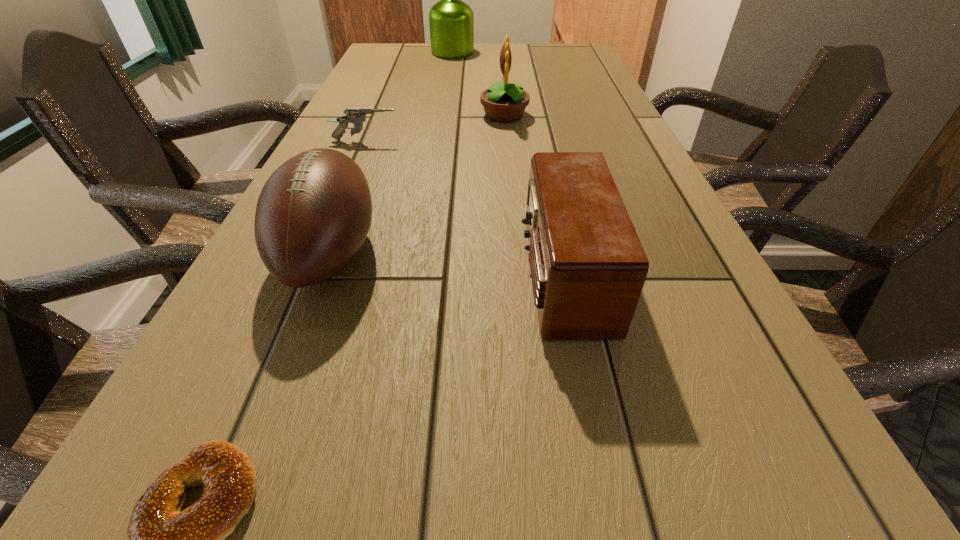
The image size is (960, 540). Find the location of `vacant space at the right edge of the desktop`. vacant space at the right edge of the desktop is located at coordinates coord(614,155).

At what (x,y) coordinates should I click in order to perform the action: click on free space at the far left corner. Please return your answer as a coordinate pair (x, y). Image resolution: width=960 pixels, height=540 pixels. Looking at the image, I should click on (383, 50).

The width and height of the screenshot is (960, 540). I want to click on free region at the far right corner, so click(585, 48).

At what (x,y) coordinates should I click in order to perform the action: click on vacant area that lies between the sunflower and the football (American). Please return your answer as a coordinate pair (x, y). Looking at the image, I should click on (417, 184).

Locate an element on the screen. vacant area that lies between the second shortest object and the fourth tallest object is located at coordinates (x=465, y=207).

The image size is (960, 540). Identify the location of unoccupied area between the tallest object and the fifth tallest object. (409, 97).

In order to click on empty location between the fifth nearest object and the olive oil in this screenshot , I will do `click(478, 84)`.

Choose which object is the third nearest neighbor to the bagel. Please provide its 2D coordinates. Your answer should be formatted as a tuple, i.e. [(x, y)], where the tuple contains the x and y coordinates of a point satisfying the conditions above.

[(357, 116)]

Select which object appears as the fifth closest to the football (American). Please provide its 2D coordinates. Your answer should be formatted as a tuple, i.e. [(x, y)], where the tuple contains the x and y coordinates of a point satisfying the conditions above.

[(451, 21)]

What are the coordinates of `free location that satisfies the following two spatial constraints: 1. on the back side of the football (American); 2. at the barrel of the fourth nearest object` in the screenshot? It's located at (372, 141).